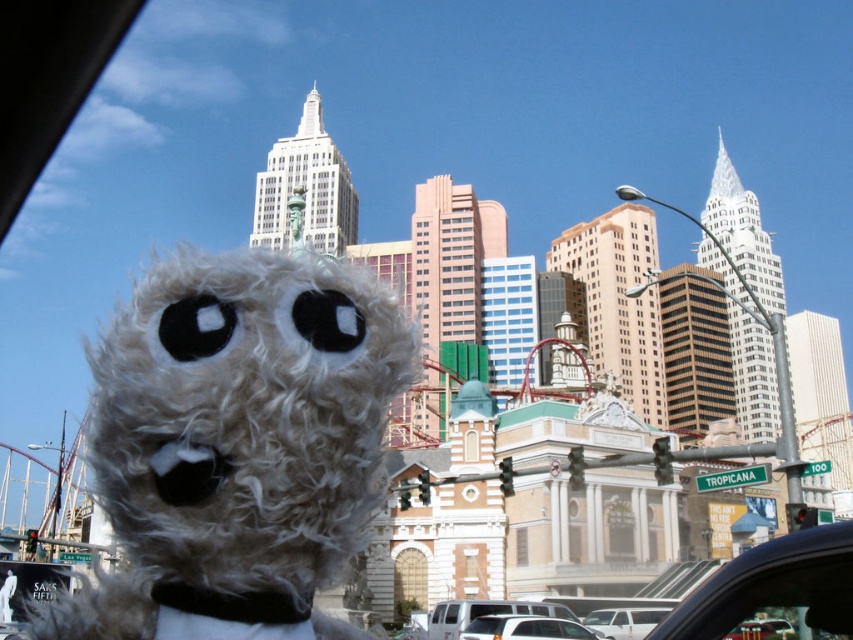
Does fluffy white stuffed animal at center have a lesser height compared to white matte car at lower center?

No, fluffy white stuffed animal at center is not shorter than white matte car at lower center.

Can you confirm if fluffy white stuffed animal at center is wider than white matte car at lower center?

Indeed, fluffy white stuffed animal at center has a greater width compared to white matte car at lower center.

Who is more forward, (311, 545) or (541, 618)?

Point (311, 545) is more forward.

At what (x,y) coordinates should I click in order to perform the action: click on fluffy white stuffed animal at center. Please return your answer as a coordinate pair (x, y). The image size is (853, 640). Looking at the image, I should click on tap(236, 444).